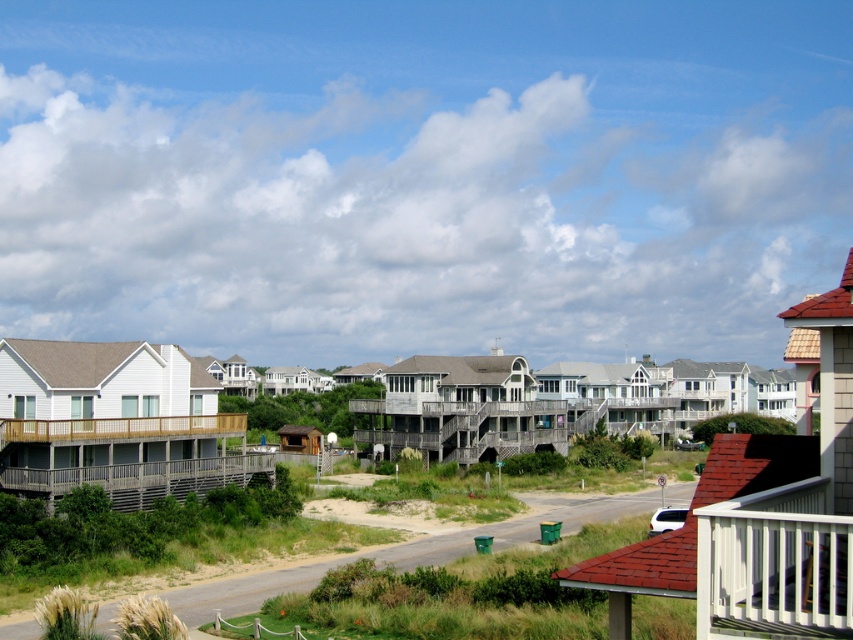
Between wooden deck at left and green sand at lower left, which one is positioned higher?

wooden deck at left is higher up.

Locate an element on the screen. The image size is (853, 640). wooden deck at left is located at coordinates (128, 456).

Between point (84, 449) and point (347, 476), which one is positioned behind?

The point (347, 476) is behind.

You are a GUI agent. You are given a task and a screenshot of the screen. Output one action in this format:
    pyautogui.click(x=<x>, y=<y>)
    Task: Click on the wooden deck at left
    This screenshot has height=640, width=853.
    Given the screenshot: What is the action you would take?
    128,456

Between wooden deck at left and wooden deck at center, which one has more height?

wooden deck at center

Between wooden deck at left and wooden deck at center, which one appears on the left side from the viewer's perspective?

From the viewer's perspective, wooden deck at left appears more on the left side.

Who is more distant from viewer, (171, 452) or (405, 433)?

The point (405, 433) is behind.

The height and width of the screenshot is (640, 853). Identify the location of wooden deck at left. (128, 456).

Is green sand at lower left taller than wooden deck at center?

No, green sand at lower left is not taller than wooden deck at center.

What do you see at coordinates (392, 547) in the screenshot? I see `green sand at lower left` at bounding box center [392, 547].

Which is behind, point (190, 609) or point (437, 410)?

The point (437, 410) is more distant.

Find the location of a particular element. Image resolution: width=853 pixels, height=640 pixels. green sand at lower left is located at coordinates (392, 547).